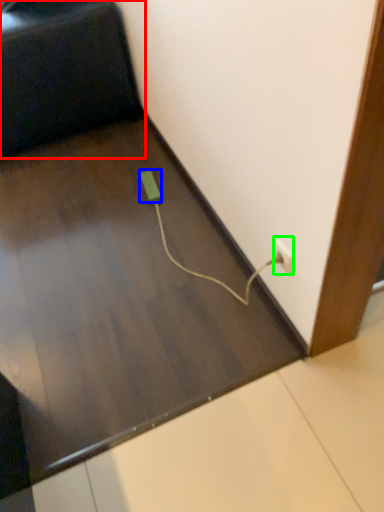
Question: Which is farther away from furniture (highlighted by a red box)? socket (highlighted by a blue box) or power plugs and sockets (highlighted by a green box)?

Choices:
 (A) socket
 (B) power plugs and sockets

Answer: (B)